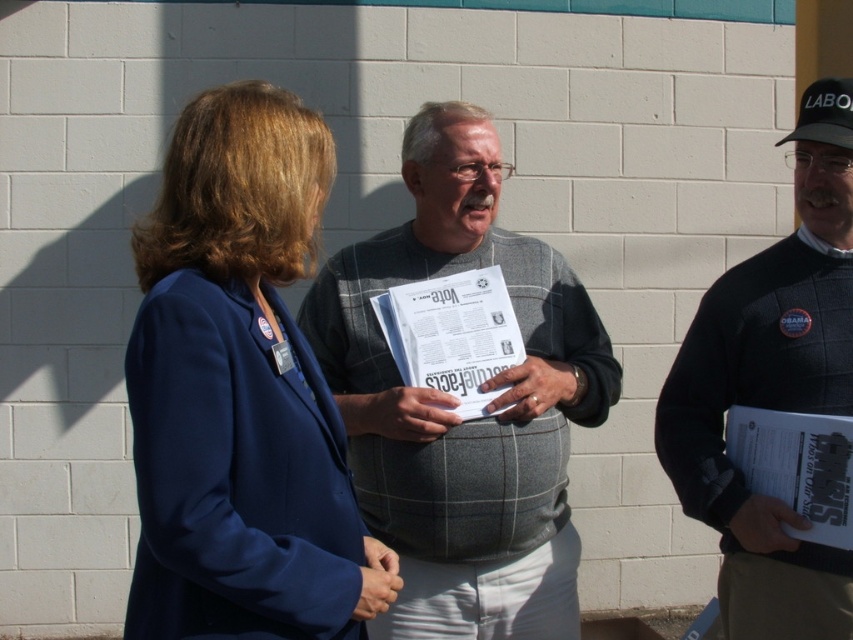
Is navy blue blazer at center thinner than white paper at center?

No, navy blue blazer at center is not thinner than white paper at center.

Is navy blue blazer at center below white paper at center?

Yes.

Which is behind, point (260, 147) or point (480, 272)?

The point (480, 272) is more distant.

Locate an element on the screen. The width and height of the screenshot is (853, 640). navy blue blazer at center is located at coordinates [241, 392].

The height and width of the screenshot is (640, 853). Describe the element at coordinates (241, 392) in the screenshot. I see `navy blue blazer at center` at that location.

I want to click on navy blue blazer at center, so click(241, 392).

Locate an element on the screen. Image resolution: width=853 pixels, height=640 pixels. navy blue blazer at center is located at coordinates pyautogui.click(x=241, y=392).

From the picture: Is black sweater at center shorter than white paper at center?

Incorrect, black sweater at center's height does not fall short of white paper at center's.

Between point (813, 214) and point (450, 308), which one is positioned in front?

Point (813, 214)

Is point (694, 321) behind point (466, 282)?

No, it is in front of (466, 282).

Locate an element on the screen. The height and width of the screenshot is (640, 853). black sweater at center is located at coordinates (772, 388).